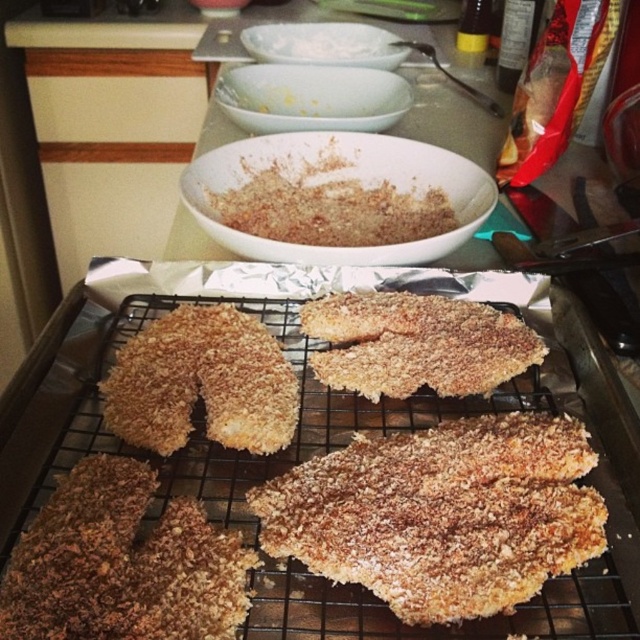
Between point (490, 371) and point (300, 44), which one is positioned behind?

The point (300, 44) is more distant.

Does golden-brown crumbly breaded chicken at center have a larger size compared to white powder at center?

No, golden-brown crumbly breaded chicken at center is not bigger than white powder at center.

Between point (444, 355) and point (369, 51), which one is positioned behind?

The point (369, 51) is more distant.

I want to click on golden-brown crumbly breaded chicken at center, so [x=417, y=344].

Does golden-brown crispy chicken at center have a smaller size compared to golden-brown crumbly breaded chicken at center?

No.

Consider the image. Does golden-brown crispy chicken at center have a larger size compared to golden-brown crumbly breaded chicken at center?

Correct, golden-brown crispy chicken at center is larger in size than golden-brown crumbly breaded chicken at center.

Where is `golden-brown crispy chicken at center`? This screenshot has height=640, width=640. golden-brown crispy chicken at center is located at coordinates (202, 381).

Locate an element on the screen. This screenshot has width=640, height=640. golden-brown crispy chicken at center is located at coordinates (202, 381).

Who is lower down, brown crumbly breaded chicken at center or golden-brown crumbly breaded chicken at center?

brown crumbly breaded chicken at center is lower down.

The image size is (640, 640). Identify the location of brown crumbly breaded chicken at center. (122, 564).